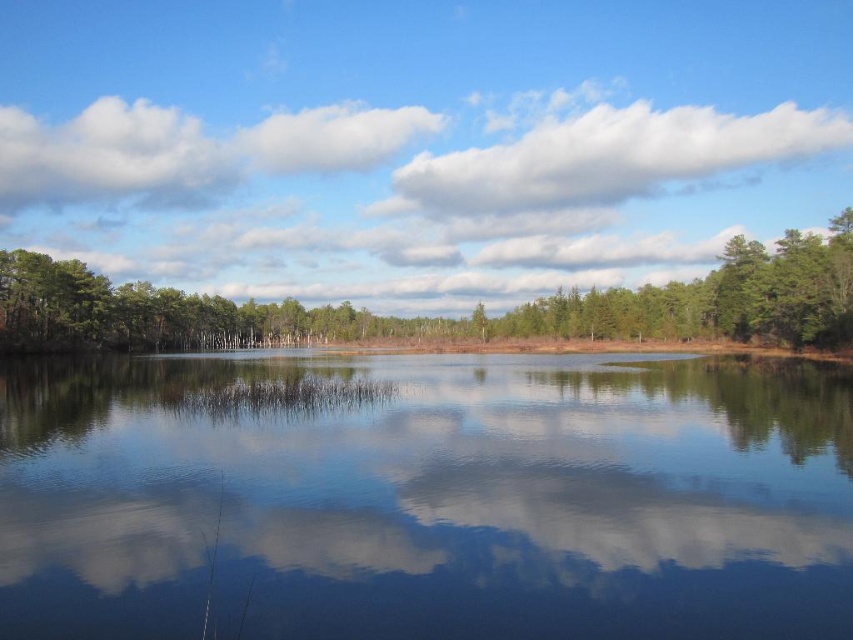
You are an artist trying to paint this landscape. You notice the green matte tree at upper center and the white fluffy cloud at upper center. Which object should you draw first if you want to follow the rule of painting smaller elements before larger ones?

The green matte tree at upper center should be drawn first because it has a smaller size compared to the white fluffy cloud at upper center.

You are standing at the origin point of the coordinate system in the image. You want to walk towards the smooth water at center. In which direction should you move?

The smooth water at center is located at coordinate point 0.777 on the x axis and 0.499 on the y axis. Since you are at the origin point, you should move in the positive x direction and slightly positive y direction to reach it.